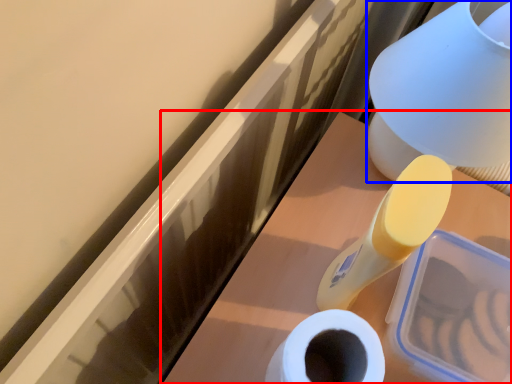
Question: Which object is closer to the camera taking this photo, vanity (highlighted by a red box) or table lamp (highlighted by a blue box)?

Choices:
 (A) vanity
 (B) table lamp

Answer: (B)